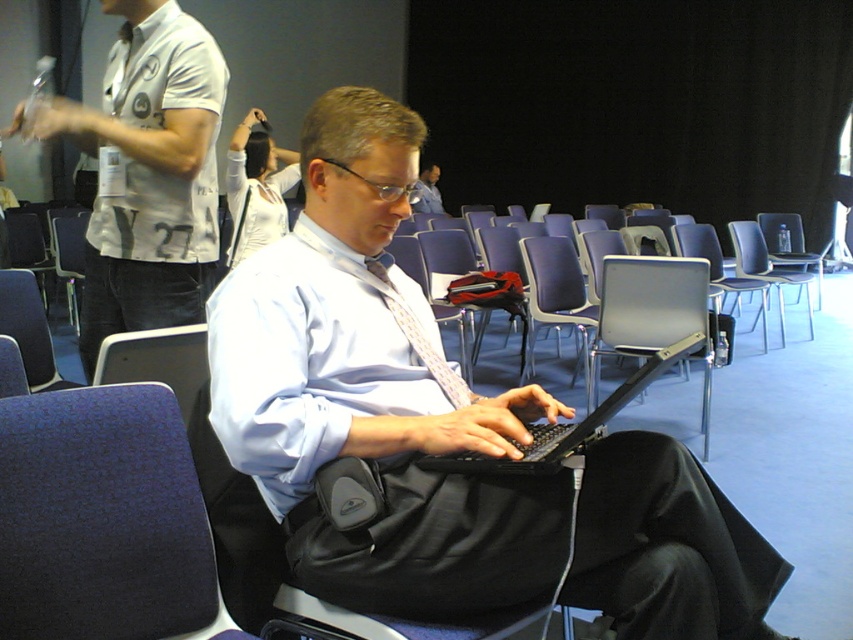
Question: Is blue fabric chair at left behind matte white shirt at center?

Choices:
 (A) yes
 (B) no

Answer: (B)

Question: Which point is closer to the camera?

Choices:
 (A) (39, 317)
 (B) (772, 275)
 (C) (169, 307)
 (D) (202, 600)

Answer: (D)

Question: Which object appears farthest from the camera in this image?

Choices:
 (A) matte white shirt at center
 (B) blue plastic chair at center
 (C) dark blue fabric chair at lower left
 (D) black plastic laptop at center

Answer: (A)

Question: Which object is closer to the camera taking this photo?

Choices:
 (A) white shirt at center
 (B) matte white shirt at center
 (C) blue fabric chair at left

Answer: (A)

Question: Does blue fabric chair at left have a smaller size compared to blue plastic chair at center?

Choices:
 (A) yes
 (B) no

Answer: (A)

Question: In this image, where is white shirt at center located relative to matte white shirt at center?

Choices:
 (A) above
 (B) below

Answer: (B)